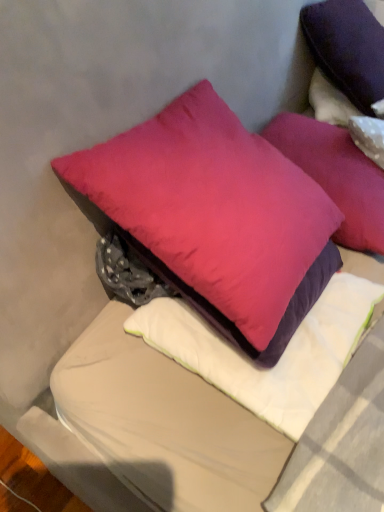
What are the coordinates of `free space above satin purple pillow at center, arranged as the 1th pillow when ordered from the bottom (from a real-world perspective)` in the screenshot? It's located at (283, 346).